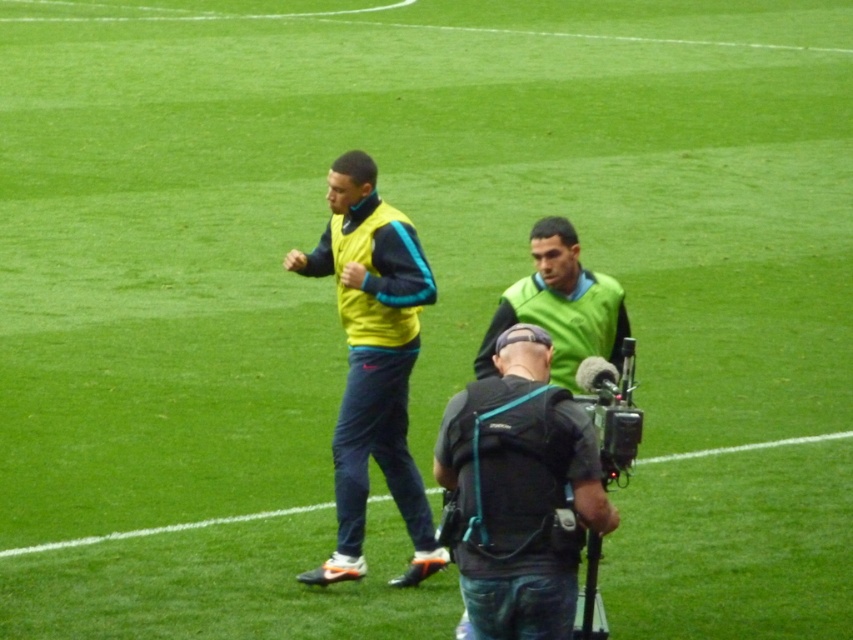
You are a photographer trying to decide which camera to use for capturing a wide shot of the soccer field. The black fabric camera at center and the black plastic video camera at center are both available. Based on their physical dimensions, which one would you choose?

The black fabric camera at center might be wider than black plastic video camera at center, so it would be better for capturing a wide shot since it has a larger width.

You are a photographer standing at the edge of the soccer field. You want to take a photo of the two individuals walking across the field. The black fabric camera at center has a maximum focus range of 5 meters. Will you be able to capture both individuals in focus with this camera?

The two individuals are 5.36 meters apart, which exceeds the camera at center maximum focus range of 5 meters. Therefore, you won

You are a soccer coach observing the field. You notice a point at coordinates (x=372, y=364). What object is located at that point?

The point at coordinates (x=372, y=364) corresponds to the yellow matte vest at center.